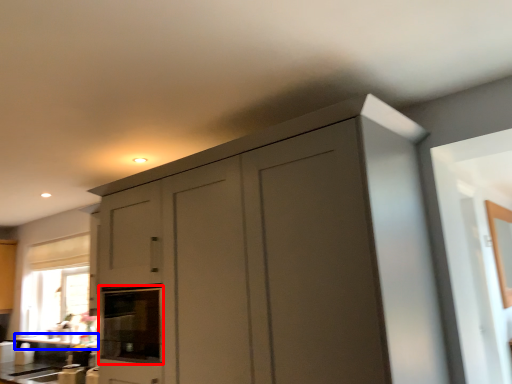
Question: Among these objects, which one is nearest to the camera, oven (highlighted by a red box) or counter top (highlighted by a blue box)?

Choices:
 (A) oven
 (B) counter top

Answer: (A)